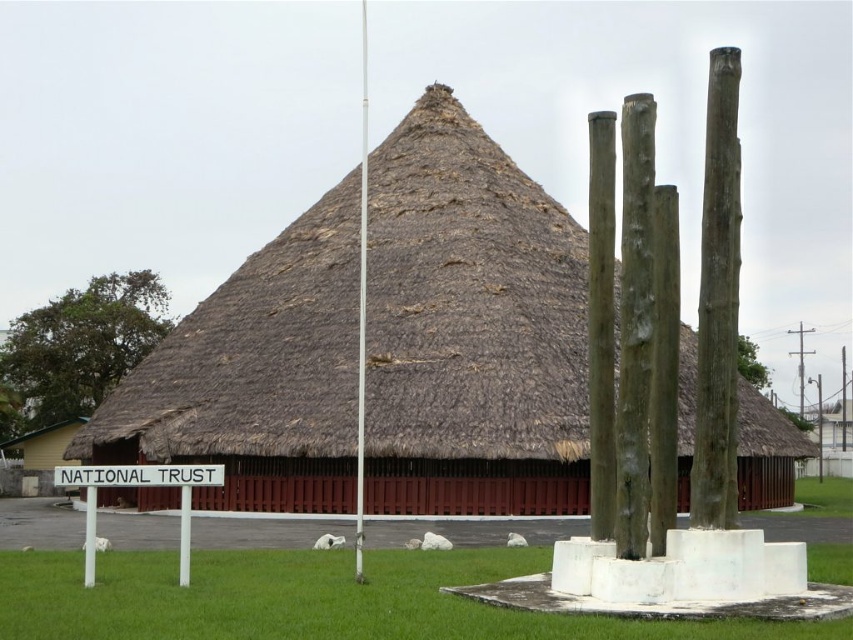
Question: Can you confirm if thatched roof hut at center is thinner than white smooth pole at center?

Choices:
 (A) no
 (B) yes

Answer: (A)

Question: Which point appears farthest from the camera in this image?

Choices:
 (A) (70, 604)
 (B) (361, 134)

Answer: (B)

Question: Which point appears closest to the camera in this image?

Choices:
 (A) (395, 173)
 (B) (589, 625)
 (C) (161, 476)

Answer: (B)

Question: Does thatched roof hut at center appear under green grass at lower center?

Choices:
 (A) yes
 (B) no

Answer: (B)

Question: Based on their relative distances, which object is farther from the white smooth pole at center?

Choices:
 (A) green grass at lower center
 (B) thatched roof hut at center
 (C) white plastic sign at center

Answer: (C)

Question: Does thatched roof hut at center lie behind white plastic sign at center?

Choices:
 (A) yes
 (B) no

Answer: (A)